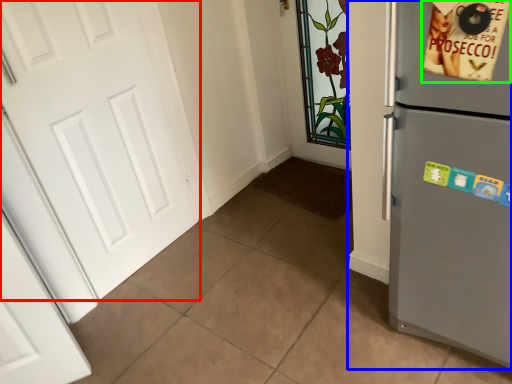
Question: Which object is positioned farthest from door (highlighted by a red box)? Select from refrigerator (highlighted by a blue box) and postcard (highlighted by a green box).

Choices:
 (A) refrigerator
 (B) postcard

Answer: (B)